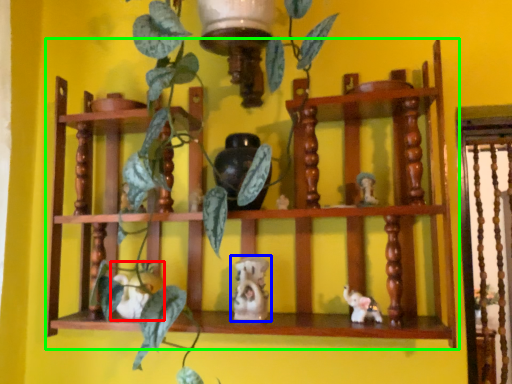
Question: Based on their relative distances, which object is farther from toy (highlighted by a red box)? Choose from toy (highlighted by a blue box) and shelf (highlighted by a green box).

Choices:
 (A) toy
 (B) shelf

Answer: (B)